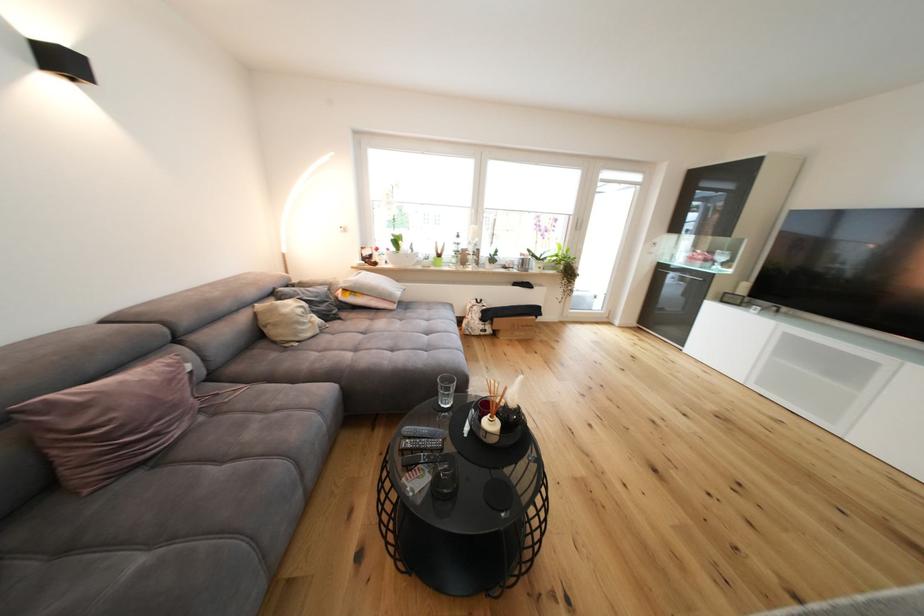
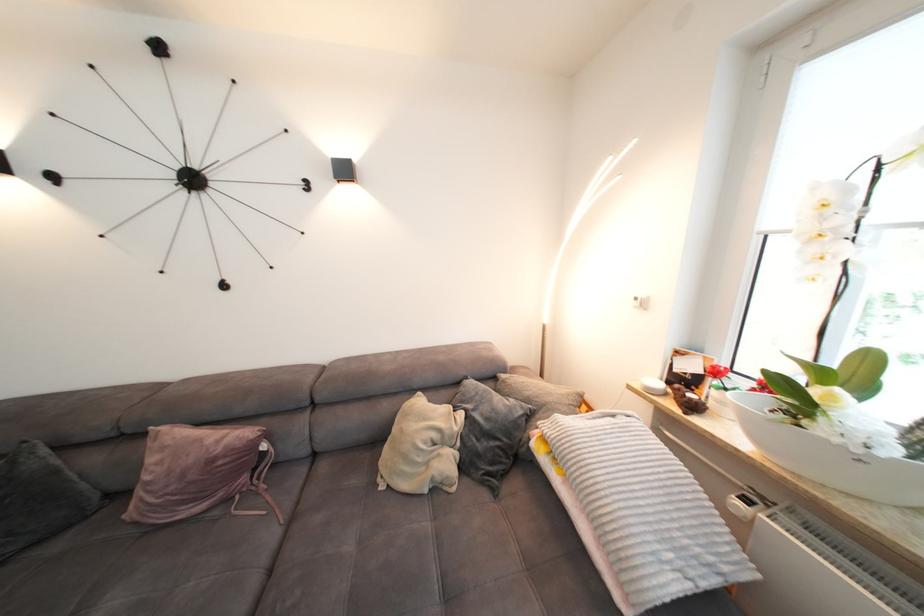
Where in the second image is the point corresponding to the point at 368,265 from the first image?

(657, 391)